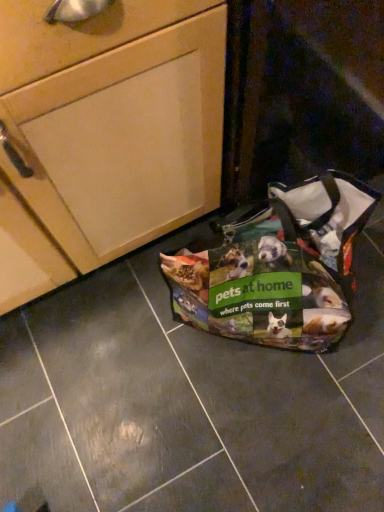
This screenshot has width=384, height=512. Find the location of `matte wood cabinet at upper left`. matte wood cabinet at upper left is located at coordinates (106, 135).

The height and width of the screenshot is (512, 384). What do you see at coordinates (106, 135) in the screenshot?
I see `matte wood cabinet at upper left` at bounding box center [106, 135].

Locate an element on the screen. The image size is (384, 512). printed fabric pet carrier at lower right is located at coordinates (277, 267).

The image size is (384, 512). What do you see at coordinates (277, 267) in the screenshot? I see `printed fabric pet carrier at lower right` at bounding box center [277, 267].

The height and width of the screenshot is (512, 384). I want to click on matte wood cabinet at upper left, so click(106, 135).

Which is more to the right, matte wood cabinet at upper left or printed fabric pet carrier at lower right?

From the viewer's perspective, printed fabric pet carrier at lower right appears more on the right side.

Which is behind, matte wood cabinet at upper left or printed fabric pet carrier at lower right?

Positioned behind is printed fabric pet carrier at lower right.

Considering the positions of points (166, 166) and (194, 313), is point (166, 166) closer to camera compared to point (194, 313)?

That is True.

From the image's perspective, which is above, matte wood cabinet at upper left or printed fabric pet carrier at lower right?

matte wood cabinet at upper left, from the image's perspective.

From a real-world perspective, does matte wood cabinet at upper left sit lower than printed fabric pet carrier at lower right?

No, from a real-world perspective, matte wood cabinet at upper left is not under printed fabric pet carrier at lower right.

Considering the relative sizes of matte wood cabinet at upper left and printed fabric pet carrier at lower right in the image provided, is matte wood cabinet at upper left wider than printed fabric pet carrier at lower right?

Indeed, matte wood cabinet at upper left has a greater width compared to printed fabric pet carrier at lower right.

Who is taller, matte wood cabinet at upper left or printed fabric pet carrier at lower right?

matte wood cabinet at upper left is taller.

Can you confirm if matte wood cabinet at upper left is bigger than printed fabric pet carrier at lower right?

Indeed, matte wood cabinet at upper left has a larger size compared to printed fabric pet carrier at lower right.

Could printed fabric pet carrier at lower right be considered to be inside matte wood cabinet at upper left?

No, printed fabric pet carrier at lower right is located outside of matte wood cabinet at upper left.

Are matte wood cabinet at upper left and printed fabric pet carrier at lower right far apart?

That's not correct — matte wood cabinet at upper left is a little close to printed fabric pet carrier at lower right.

Is matte wood cabinet at upper left facing away from printed fabric pet carrier at lower right?

No, matte wood cabinet at upper left is not facing the opposite direction of printed fabric pet carrier at lower right.

How much distance is there between matte wood cabinet at upper left and printed fabric pet carrier at lower right?

matte wood cabinet at upper left and printed fabric pet carrier at lower right are 10.44 inches apart.

Where is `handbag behind the matte wood cabinet at upper left`? handbag behind the matte wood cabinet at upper left is located at coordinates (277, 267).

Is printed fabric pet carrier at lower right at the right side of matte wood cabinet at upper left?

Yes, printed fabric pet carrier at lower right is to the right of matte wood cabinet at upper left.

Is printed fabric pet carrier at lower right in front of or behind matte wood cabinet at upper left in the image?

Clearly, printed fabric pet carrier at lower right is behind matte wood cabinet at upper left.

Which is closer, (334,281) or (80,66)?

Point (334,281) is farther from the camera than point (80,66).

From the image's perspective, would you say printed fabric pet carrier at lower right is shown under matte wood cabinet at upper left?

Yes.

From a real-world perspective, is printed fabric pet carrier at lower right located higher than matte wood cabinet at upper left?

No.

Looking at their sizes, would you say printed fabric pet carrier at lower right is wider or thinner than matte wood cabinet at upper left?

In the image, printed fabric pet carrier at lower right appears to be more narrow than matte wood cabinet at upper left.

Considering the sizes of printed fabric pet carrier at lower right and matte wood cabinet at upper left in the image, is printed fabric pet carrier at lower right taller or shorter than matte wood cabinet at upper left?

Considering their sizes, printed fabric pet carrier at lower right has less height than matte wood cabinet at upper left.

Does printed fabric pet carrier at lower right have a smaller size compared to matte wood cabinet at upper left?

Yes.

Looking at this image, is printed fabric pet carrier at lower right positioned beyond the bounds of matte wood cabinet at upper left?

Indeed, printed fabric pet carrier at lower right is completely outside matte wood cabinet at upper left.

Is printed fabric pet carrier at lower right far away from matte wood cabinet at upper left?

No, printed fabric pet carrier at lower right is not far from matte wood cabinet at upper left.

Is printed fabric pet carrier at lower right turned away from matte wood cabinet at upper left?

Yes, printed fabric pet carrier at lower right is positioned with its back facing matte wood cabinet at upper left.

What's the angular difference between printed fabric pet carrier at lower right and matte wood cabinet at upper left's facing directions?

They differ by 0.000302 degrees in their facing directions.

Locate an element on the screen. The width and height of the screenshot is (384, 512). handbag located underneath the matte wood cabinet at upper left (from a real-world perspective) is located at coordinates (277, 267).

The height and width of the screenshot is (512, 384). In order to click on cabinetry in front of the printed fabric pet carrier at lower right in this screenshot , I will do `click(106, 135)`.

Where is `cabinetry that is above the printed fabric pet carrier at lower right (from a real-world perspective)`? cabinetry that is above the printed fabric pet carrier at lower right (from a real-world perspective) is located at coordinates (106, 135).